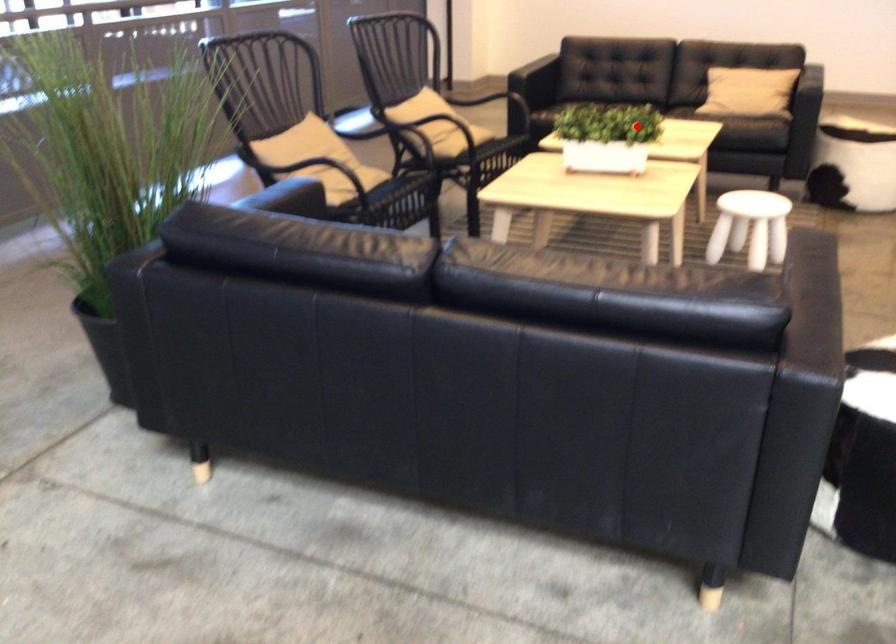
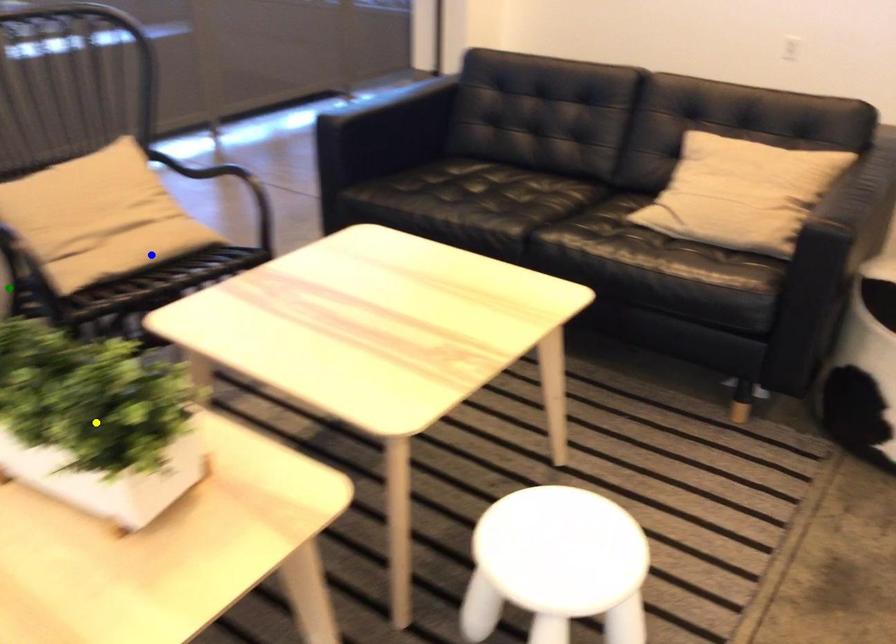
Question: I am providing you with two images of the same scene from different viewpoints. A red point is marked on the first image. You are given multiple points on the second image. Which point in image 2 is actually the same real-world point as the red point in image 1?

Choices:
 (A) green point
 (B) blue point
 (C) yellow point

Answer: (C)